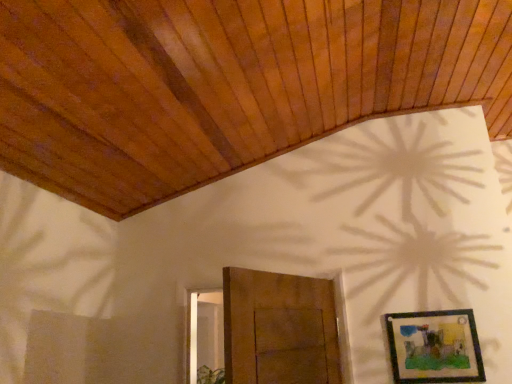
Find the location of `wooden framed picture at lower right`. wooden framed picture at lower right is located at coordinates (434, 347).

What do you see at coordinates (434, 347) in the screenshot? This screenshot has width=512, height=384. I see `wooden framed picture at lower right` at bounding box center [434, 347].

Identify the location of wooden framed picture at lower right. (434, 347).